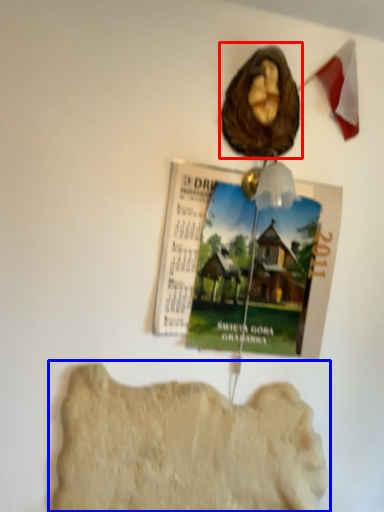
Question: Which object appears closest to the camera in this image, art (highlighted by a red box) or rock formation (highlighted by a blue box)?

Choices:
 (A) art
 (B) rock formation

Answer: (B)